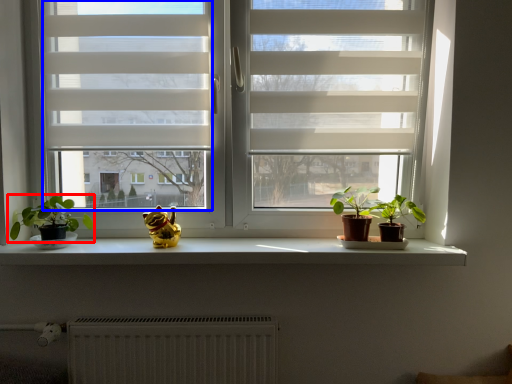
Question: Which object appears closest to the camera in this image, houseplant (highlighted by a red box) or window screen (highlighted by a blue box)?

Choices:
 (A) houseplant
 (B) window screen

Answer: (A)